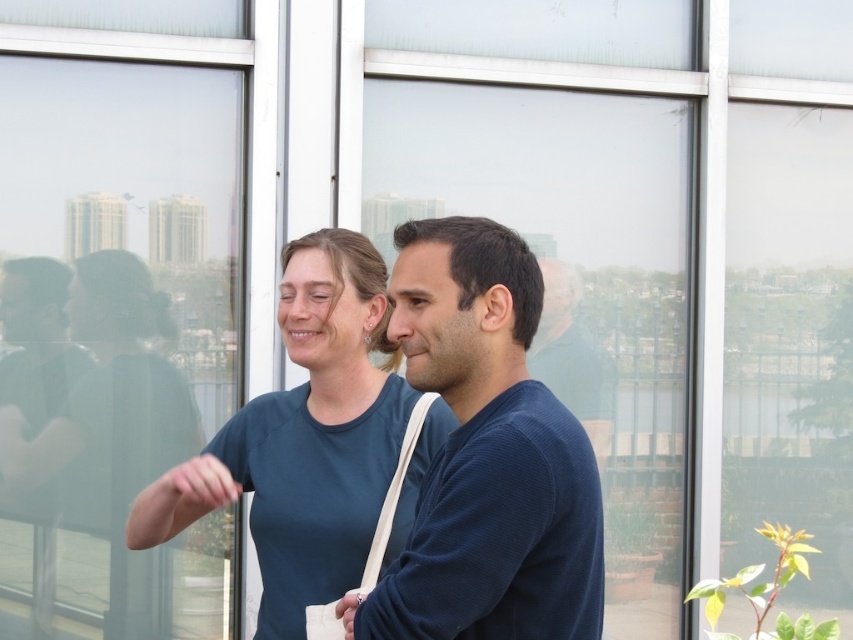
Does dark blue sweater at center have a smaller size compared to teal matte shirt at center?

Correct, dark blue sweater at center occupies less space than teal matte shirt at center.

In the scene shown: Between dark blue sweater at center and teal matte shirt at center, which one has more height?

teal matte shirt at center is taller.

In order to click on dark blue sweater at center in this screenshot , I will do `click(486, 456)`.

Measure the distance from transparent glass window at center to dark blue sweater at center.

transparent glass window at center and dark blue sweater at center are 5.98 feet apart.

Between transparent glass window at center and dark blue sweater at center, which one is positioned lower?

Positioned lower is dark blue sweater at center.

Between point (67, 602) and point (453, 529), which one is positioned behind?

Positioned behind is point (67, 602).

This screenshot has height=640, width=853. Find the location of `transparent glass window at center`. transparent glass window at center is located at coordinates (114, 337).

Can you confirm if dark blue sweater at center is bigger than blue knitted sweater at center?

Yes.

Is dark blue sweater at center shorter than blue knitted sweater at center?

Incorrect, dark blue sweater at center's height does not fall short of blue knitted sweater at center's.

Is point (460, 365) farther from viewer compared to point (553, 355)?

No.

The image size is (853, 640). Identify the location of dark blue sweater at center. (486, 456).